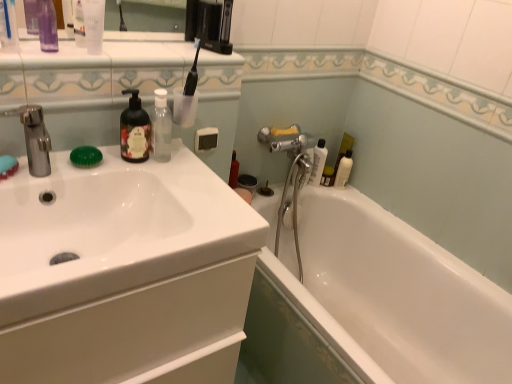
Where is `green translucent soap at left`? green translucent soap at left is located at coordinates (86, 156).

This screenshot has height=384, width=512. What do you see at coordinates (135, 130) in the screenshot?
I see `matte black soap dispenser at upper left` at bounding box center [135, 130].

Image resolution: width=512 pixels, height=384 pixels. What do you see at coordinates (318, 163) in the screenshot? I see `white glossy bottle at upper right, the 2th toiletry viewed from the back` at bounding box center [318, 163].

The image size is (512, 384). What do you see at coordinates (47, 26) in the screenshot?
I see `transparent plastic bottle at upper left, positioned as the 1th toiletry in left-to-right order` at bounding box center [47, 26].

What is the approximate width of transparent plastic bottle at upper center, the 1th mouthwash when ordered from right to left?

transparent plastic bottle at upper center, the 1th mouthwash when ordered from right to left, is 3.36 inches in width.

Identify the location of green translucent soap at left. The height and width of the screenshot is (384, 512). (86, 156).

Is matte black soap dispenser at upper left a part of white glossy sink at left?

Actually, matte black soap dispenser at upper left is outside white glossy sink at left.

Considering the sizes of objects white glossy sink at left and matte black soap dispenser at upper left in the image provided, who is wider, white glossy sink at left or matte black soap dispenser at upper left?

Wider between the two is white glossy sink at left.

Can you tell me how much white glossy sink at left and matte black soap dispenser at upper left differ in facing direction?

The facing directions of white glossy sink at left and matte black soap dispenser at upper left are 0.961 degrees apart.

How distant is white glossy sink at left from matte black soap dispenser at upper left?

They are 24.05 centimeters apart.

Considering the sizes of objects transparent plastic bottle at upper center, the 2th mouthwash from the left, and white glossy bottle at right, which is the fourth toiletry in left-to-right order, in the image provided, who is smaller, transparent plastic bottle at upper center, the 2th mouthwash from the left, or white glossy bottle at right, which is the fourth toiletry in left-to-right order,?

white glossy bottle at right, which is the fourth toiletry in left-to-right order.

Is transparent plastic bottle at upper center, the 2th mouthwash when ordered from top to bottom, inside the boundaries of white glossy bottle at right, which is the first toiletry in back-to-front order, or outside?

transparent plastic bottle at upper center, the 2th mouthwash when ordered from top to bottom, is not inside white glossy bottle at right, which is the first toiletry in back-to-front order, it's outside.

Is transparent plastic bottle at upper center, the 1th mouthwash from the bottom, placed right next to white glossy bottle at right, which ranks as the 4th toiletry in front-to-back order?

No, transparent plastic bottle at upper center, the 1th mouthwash from the bottom, is not in contact with white glossy bottle at right, which ranks as the 4th toiletry in front-to-back order.

Is point (170, 134) closer to viewer compared to point (337, 184)?

That is True.

How many degrees apart are the facing directions of green translucent soap at left and clear plastic bottle at upper left, marked as the second mouthwash in a bottom-to-top arrangement?

There is a 73.4-degree angle between the facing directions of green translucent soap at left and clear plastic bottle at upper left, marked as the second mouthwash in a bottom-to-top arrangement.

Does green translucent soap at left have a lesser width compared to clear plastic bottle at upper left, acting as the first mouthwash starting from the top?

No.

From a real-world perspective, which is physically below, green translucent soap at left or clear plastic bottle at upper left, marked as the second mouthwash in a bottom-to-top arrangement?

green translucent soap at left.

Does green translucent soap at left appear on the right side of clear plastic bottle at upper left, marked as the second mouthwash in a bottom-to-top arrangement?

Yes, green translucent soap at left is to the right of clear plastic bottle at upper left, marked as the second mouthwash in a bottom-to-top arrangement.

Considering the sizes of objects white glossy sink at left and transparent plastic bottle at upper left, which is the 4th toiletry in back-to-front order, in the image provided, who is shorter, white glossy sink at left or transparent plastic bottle at upper left, which is the 4th toiletry in back-to-front order,?

Standing shorter between the two is white glossy sink at left.

Is white glossy sink at left far away from transparent plastic bottle at upper left, positioned as the 1th toiletry in left-to-right order?

Actually, white glossy sink at left and transparent plastic bottle at upper left, positioned as the 1th toiletry in left-to-right order, are a little close together.

Based on the photo, which is more to the right, white glossy sink at left or transparent plastic bottle at upper left, positioned as the 1th toiletry in left-to-right order?

white glossy sink at left.

Is white glossy sink at left thinner than transparent plastic bottle at upper left, the fourth toiletry positioned from the right?

→ No, white glossy sink at left is not thinner than transparent plastic bottle at upper left, the fourth toiletry positioned from the right.

Considering the relative sizes of white glossy bottle at right, which is the fourth toiletry in left-to-right order, and clear plastic bottle at upper left, which ranks as the second mouthwash in right-to-left order, in the image provided, is white glossy bottle at right, which is the fourth toiletry in left-to-right order, taller than clear plastic bottle at upper left, which ranks as the second mouthwash in right-to-left order,?

Indeed, white glossy bottle at right, which is the fourth toiletry in left-to-right order, has a greater height compared to clear plastic bottle at upper left, which ranks as the second mouthwash in right-to-left order.

Considering the relative sizes of white glossy bottle at right, which is the first toiletry in back-to-front order, and clear plastic bottle at upper left, marked as the second mouthwash in a bottom-to-top arrangement, in the image provided, is white glossy bottle at right, which is the first toiletry in back-to-front order, thinner than clear plastic bottle at upper left, marked as the second mouthwash in a bottom-to-top arrangement,?

In fact, white glossy bottle at right, which is the first toiletry in back-to-front order, might be wider than clear plastic bottle at upper left, marked as the second mouthwash in a bottom-to-top arrangement.

Based on the photo, would you say white glossy bottle at right, which is the first toiletry in back-to-front order, is a long distance from clear plastic bottle at upper left, which ranks as the second mouthwash in right-to-left order?

That's right, there is a large distance between white glossy bottle at right, which is the first toiletry in back-to-front order, and clear plastic bottle at upper left, which ranks as the second mouthwash in right-to-left order.

Would you say white glossy bottle at right, which is the fourth toiletry in left-to-right order, is outside clear plastic bottle at upper left, which ranks as the second mouthwash in right-to-left order?

Yes, white glossy bottle at right, which is the fourth toiletry in left-to-right order, is outside of clear plastic bottle at upper left, which ranks as the second mouthwash in right-to-left order.

Choose the correct answer: Is white glossy sink at left inside white glossy bottle at right, which is the first toiletry in back-to-front order, or outside it?

white glossy sink at left cannot be found inside white glossy bottle at right, which is the first toiletry in back-to-front order.

In terms of width, does white glossy sink at left look wider or thinner when compared to white glossy bottle at right, which is the first toiletry in back-to-front order?

Considering their sizes, white glossy sink at left looks broader than white glossy bottle at right, which is the first toiletry in back-to-front order.

Is white glossy sink at left positioned behind white glossy bottle at right, arranged as the 1th toiletry when viewed from the right?

No, the depth of white glossy sink at left is less than that of white glossy bottle at right, arranged as the 1th toiletry when viewed from the right.

The height and width of the screenshot is (384, 512). Identify the location of the 2nd toiletry located beneath the green translucent soap at left (from a real-world perspective). (343, 170).

Which object is wider, white glossy bottle at right, which is the fourth toiletry in left-to-right order, or green translucent soap at left?

With larger width is green translucent soap at left.

From a real-world perspective, relative to green translucent soap at left, is white glossy bottle at right, which ranks as the 4th toiletry in front-to-back order, vertically above or below?

In terms of real-world spatial position, white glossy bottle at right, which ranks as the 4th toiletry in front-to-back order, is below green translucent soap at left.

Can you confirm if white glossy bottle at right, which ranks as the 4th toiletry in front-to-back order, is positioned to the left of green translucent soap at left?

In fact, white glossy bottle at right, which ranks as the 4th toiletry in front-to-back order, is to the right of green translucent soap at left.

Locate an element on the screen. This screenshot has height=384, width=512. sink that appears in front of the matte black soap dispenser at upper left is located at coordinates (114, 229).

Where is `mouthwash that is the 1st one when counting leftward from the white glossy bottle at right, which is the fourth toiletry in left-to-right order`? mouthwash that is the 1st one when counting leftward from the white glossy bottle at right, which is the fourth toiletry in left-to-right order is located at coordinates (161, 127).

Considering their positions, is white glossy bathtub at lower right positioned closer to clear plastic bottle at upper left, acting as the first mouthwash starting from the top, than white glossy bottle at upper right, the 2th toiletry viewed from the back?

Among the two, white glossy bottle at upper right, the 2th toiletry viewed from the back, is located nearer to clear plastic bottle at upper left, acting as the first mouthwash starting from the top.

Estimate the real-world distances between objects in this image. Which object is further from transparent plastic bottle at upper center, the 2th mouthwash from the left, white glossy bottle at right, which ranks as the 4th toiletry in front-to-back order, or clear plastic bottle at upper left, marked as the second mouthwash in a bottom-to-top arrangement?

Among the two, white glossy bottle at right, which ranks as the 4th toiletry in front-to-back order, is located further to transparent plastic bottle at upper center, the 2th mouthwash from the left.

When comparing their distances from transparent plastic bottle at upper left, which is the 4th toiletry in back-to-front order, does white glossy bottle at upper right, which ranks as the 2th toiletry in right-to-left order, or white glossy sink at left seem closer?

white glossy sink at left lies closer to transparent plastic bottle at upper left, which is the 4th toiletry in back-to-front order, than the other object.

Estimate the real-world distances between objects in this image. Which object is closer to white glossy sink at left, green translucent soap at left or transparent plastic bottle at upper left, the 3th toiletry when ordered from right to left?

The object closer to white glossy sink at left is green translucent soap at left.

Considering their positions, is clear plastic bottle at upper left, which ranks as the second mouthwash in right-to-left order, positioned further to matte black soap dispenser at upper left than green translucent soap at left?

The object further to matte black soap dispenser at upper left is clear plastic bottle at upper left, which ranks as the second mouthwash in right-to-left order.

When comparing their distances from transparent plastic bottle at upper left, the fourth toiletry positioned from the right, does green translucent soap at left or matte black soap dispenser at upper left seem further?

The object further to transparent plastic bottle at upper left, the fourth toiletry positioned from the right, is green translucent soap at left.

Which object lies further to the anchor point green translucent soap at left, white glossy bottle at right, which ranks as the 4th toiletry in front-to-back order, or white glossy sink at left?

white glossy bottle at right, which ranks as the 4th toiletry in front-to-back order, is positioned further to the anchor green translucent soap at left.

From the image, which object appears to be nearer to green translucent soap at left, clear plastic bottle at upper left, marked as the second mouthwash in a bottom-to-top arrangement, or matte black soap dispenser at upper left?

matte black soap dispenser at upper left is closer to green translucent soap at left.

At what (x,y) coordinates should I click in order to perform the action: click on soap dispenser positioned between transparent plastic bottle at upper left, which appears as the second toiletry when viewed from the front, and white glossy bottle at upper right, the 2th toiletry viewed from the back, from near to far. Please return your answer as a coordinate pair (x, y). Looking at the image, I should click on (135, 130).

This screenshot has width=512, height=384. Find the location of `toiletry that lies between transparent plastic bottle at upper left, positioned as the 1th toiletry in left-to-right order, and matte black soap dispenser at upper left from top to bottom`. toiletry that lies between transparent plastic bottle at upper left, positioned as the 1th toiletry in left-to-right order, and matte black soap dispenser at upper left from top to bottom is located at coordinates (94, 24).

Locate an element on the screen. soap dispenser between white glossy sink at left and white glossy bottle at upper right, the third toiletry in the left-to-right sequence, along the z-axis is located at coordinates (135, 130).

Locate an element on the screen. The height and width of the screenshot is (384, 512). mouthwash between transparent plastic bottle at upper left, the fourth toiletry positioned from the right, and white glossy sink at left, in the vertical direction is located at coordinates (161, 127).